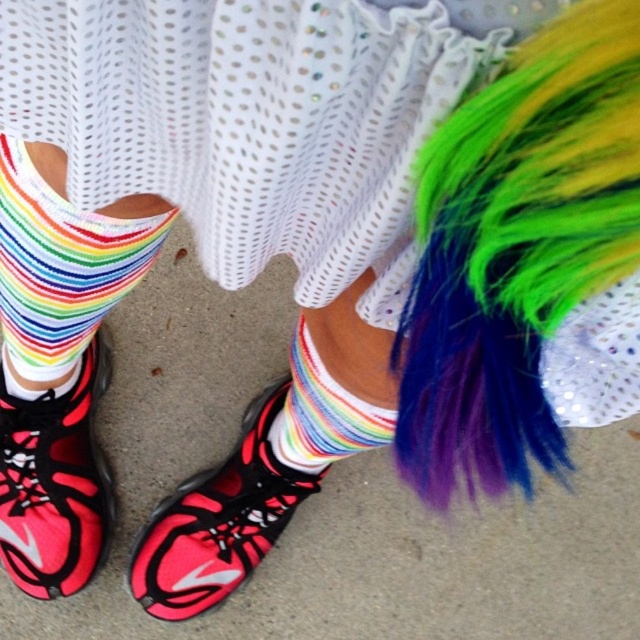
Question: Which is nearer to the neon pink synthetic sneaker at lower left?

Choices:
 (A) rainbow striped socks at lower left
 (B) rainbow feather boa at lower right
 (C) rainbow striped sock at center
 (D) shiny pink and black sneaker at lower left

Answer: (C)

Question: Estimate the real-world distances between objects in this image. Which object is closer to the rainbow striped sock at center?

Choices:
 (A) rainbow striped socks at lower left
 (B) rainbow feather boa at lower right

Answer: (A)

Question: Which point is farther from the camera taking this photo?

Choices:
 (A) (145, 534)
 (B) (35, 195)

Answer: (A)

Question: Can you confirm if rainbow striped socks at lower left is positioned to the left of neon pink synthetic sneaker at lower left?

Choices:
 (A) no
 (B) yes

Answer: (B)

Question: In this image, where is rainbow striped socks at lower left located relative to shiny pink and black sneaker at lower left?

Choices:
 (A) below
 (B) above

Answer: (B)

Question: Does rainbow feather boa at lower right lie behind rainbow striped socks at lower left?

Choices:
 (A) no
 (B) yes

Answer: (A)